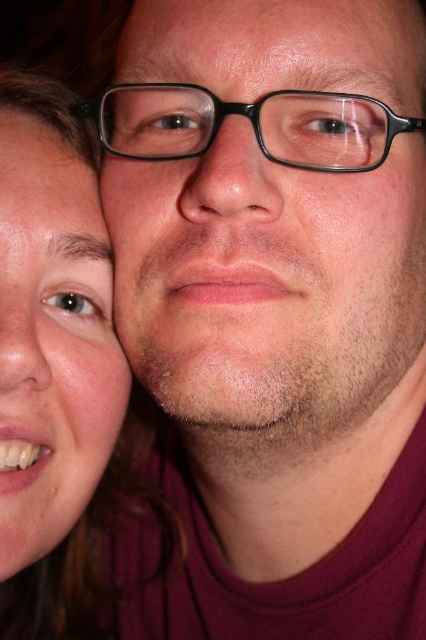
Is matte black glasses at center further to camera compared to matte skin face at lower left?

No, matte black glasses at center is closer to the viewer.

Who is more forward, (379, 38) or (5, 218)?

Point (379, 38) is more forward.

The height and width of the screenshot is (640, 426). Identify the location of matte black glasses at center. (268, 284).

Is matte black glasses at center to the left of smooth skin at upper center from the viewer's perspective?

Incorrect, matte black glasses at center is not on the left side of smooth skin at upper center.

Is matte black glasses at center above smooth skin at upper center?

No, matte black glasses at center is not above smooth skin at upper center.

Locate an element on the screen. matte black glasses at center is located at coordinates (268, 284).

Does matte skin face at lower left come in front of smooth skin at upper center?

Yes, matte skin face at lower left is closer to the viewer.

Does point (71, 252) come behind point (423, 20)?

No, (71, 252) is closer to viewer.

Locate an element on the screen. matte skin face at lower left is located at coordinates tap(51, 340).